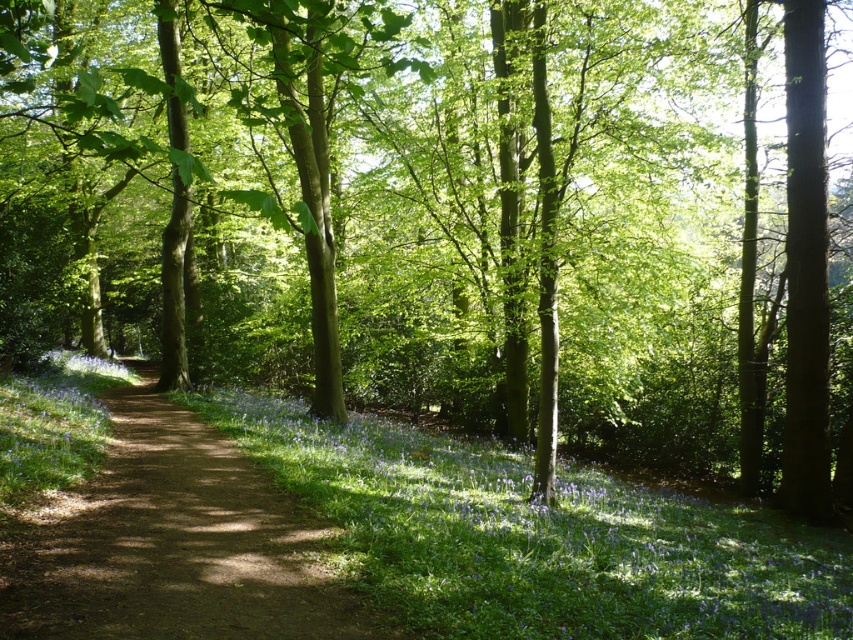
You are a hiker walking along the dirt path at center and want to pick some blue matte flowers at center. Can you reach the flowers without stepping off the path?

The blue matte flowers at center are positioned under the dirt path at center, so you can reach them while staying on the path.

You are a hiker standing at the start of the dirt path in the forest. You want to pick some blue matte flowers at center. In which direction should you walk to reach them?

The blue matte flowers at center are located at point (537, 538). Since you are at the start of the dirt path, you should walk forward along the path towards the center of the image to reach the flowers.

You are a hiker who wants to take a photo of the blue matte flowers at center and the dirt path at center. Which one should you focus on if you want the closer object to be in sharp focus?

The blue matte flowers at center is taller than the dirt path at center, so you should focus on the blue matte flowers at center since it is closer to the camera.